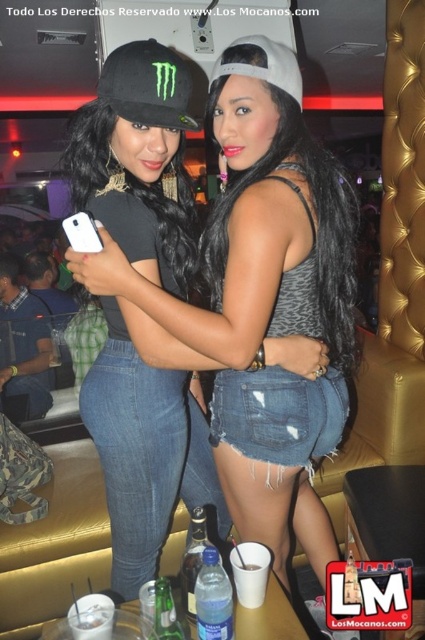
You are a bartender in a nightclub. You need to place a green glass bottle at lower left at the point with coordinates (166, 611). The table you want to place it on is 0.9 meters wide. Can you fit the green glass bottle at lower left on the table?

The green glass bottle at lower left is located at point (166, 611). Since the table is 0.9 meters wide, the bottle can be placed there as long as its dimensions are within the table size. However, the exact dimensions of the bottle aren

You are standing at the entrance of the nightclub and want to take a photo of both individuals. The first person is at point [178,115] and the second person is at point [198,548]. Which individual should you position closer to the camera to ensure both are in focus?

You should position the individual at point [178,115] closer to the camera because they are in front of the other person at point [198,548], ensuring both are in focus.

You are a photographer trying to capture a clear photo of both the green glass bottle at lower left and the white matte smartphone at upper left. Which object should you focus on first to ensure it appears sharp in the photo?

You should focus on the green glass bottle at lower left first because it is closer to you than the white matte smartphone at upper left, so focusing on the closer object ensures it will be sharp.